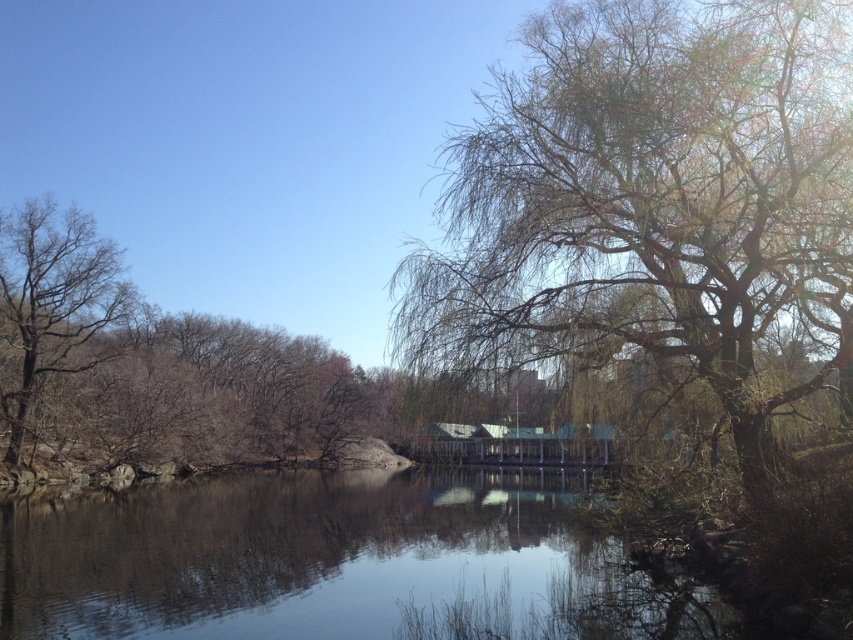
Question: Does bare branches at right appear over bare wood tree at left?

Choices:
 (A) yes
 (B) no

Answer: (A)

Question: Does smooth reflective water at center appear on the left side of bare wood tree at left?

Choices:
 (A) yes
 (B) no

Answer: (B)

Question: Is bare branches at right thinner than smooth reflective water at center?

Choices:
 (A) yes
 (B) no

Answer: (A)

Question: Which point is closer to the camera?

Choices:
 (A) bare wood tree at left
 (B) smooth reflective water at center

Answer: (B)

Question: Which of the following is the farthest from the observer?

Choices:
 (A) smooth reflective water at center
 (B) bare wood tree at left
 (C) bare branches at right

Answer: (B)

Question: Among these objects, which one is nearest to the camera?

Choices:
 (A) smooth reflective water at center
 (B) bare branches at right
 (C) bare wood tree at left

Answer: (B)